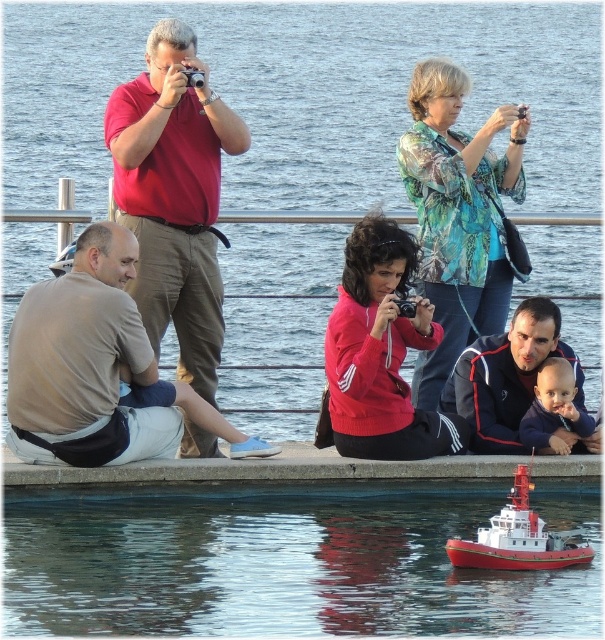
Who is more distant from viewer, (549, 556) or (554, 429)?

Positioned behind is point (554, 429).

Which is more to the left, red plastic toy boat at lower right or dark blue fleece at lower right?

Positioned to the left is red plastic toy boat at lower right.

Where is `red plastic toy boat at lower right`? The image size is (605, 640). red plastic toy boat at lower right is located at coordinates (517, 538).

Identify the location of red plastic toy boat at lower right. (x=517, y=538).

Based on the photo, who is shorter, matte red shirt at upper left or brown cotton t-shirt at lower left?

With less height is brown cotton t-shirt at lower left.

Between point (203, 380) and point (65, 461), which one is positioned behind?

The point (203, 380) is more distant.

What do you see at coordinates (174, 196) in the screenshot?
I see `matte red shirt at upper left` at bounding box center [174, 196].

Identify the location of matte red shirt at upper left. (174, 196).

Who is shorter, transparent water at lower center or concrete ledge at lower center?

concrete ledge at lower center is shorter.

Is point (240, 381) positioned in front of point (56, 477)?

No, it is behind (56, 477).

Where is `transparent water at lower center`? The width and height of the screenshot is (605, 640). transparent water at lower center is located at coordinates (306, 93).